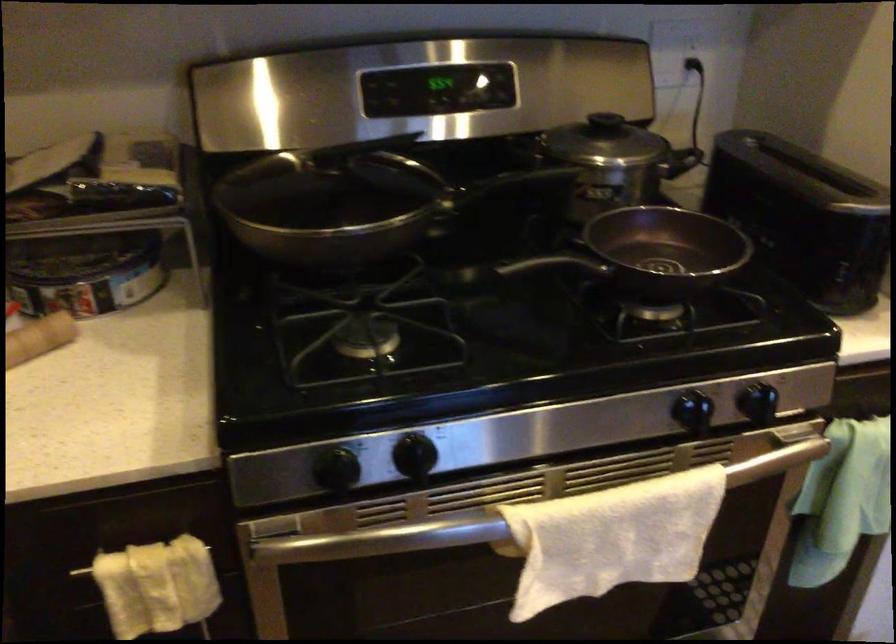
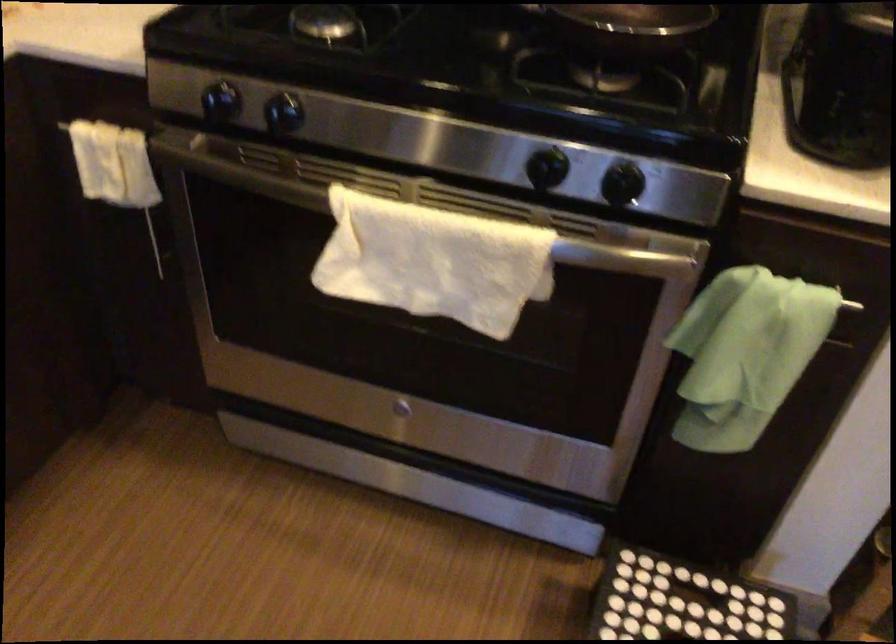
Where in the second image is the point corresponding to point 764,400 from the first image?

(623, 183)